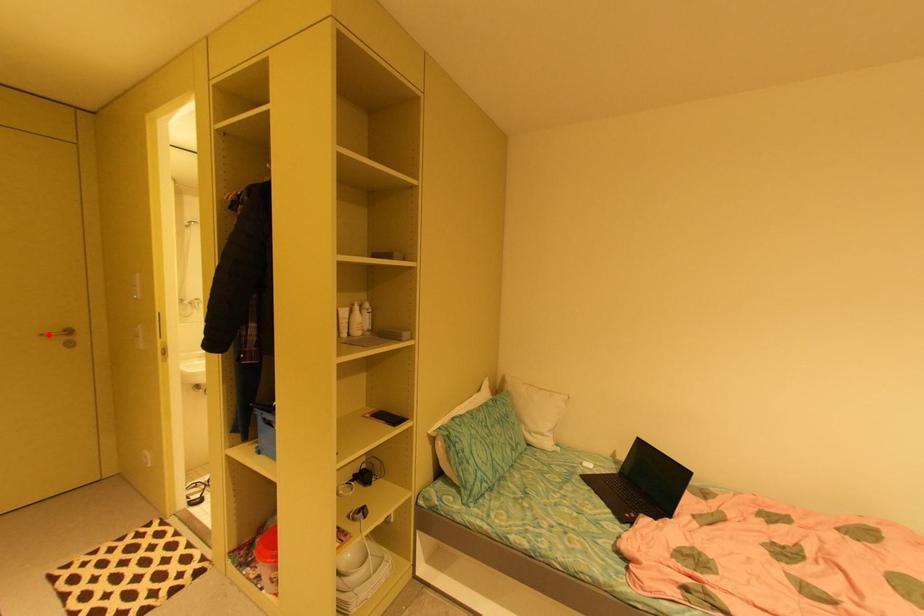
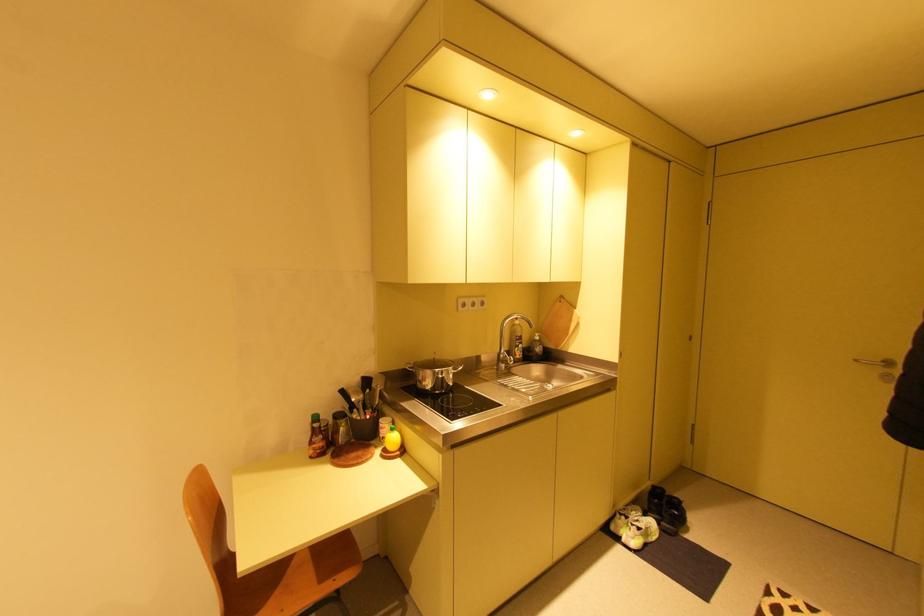
Locate, in the second image, the point that corresponds to the highlighted location in the first image.

(861, 361)